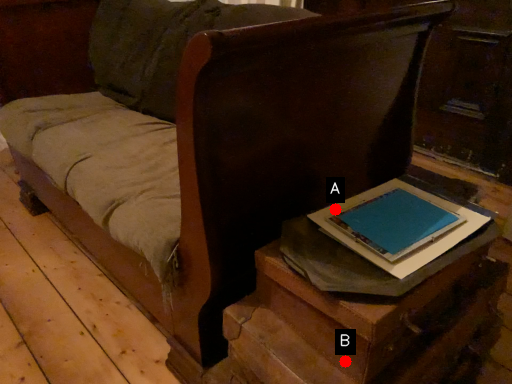
Question: Two points are circled on the image, labeled by A and B beside each circle. Which of the following is the farthest from the observer?

Choices:
 (A) A is further
 (B) B is further

Answer: (A)